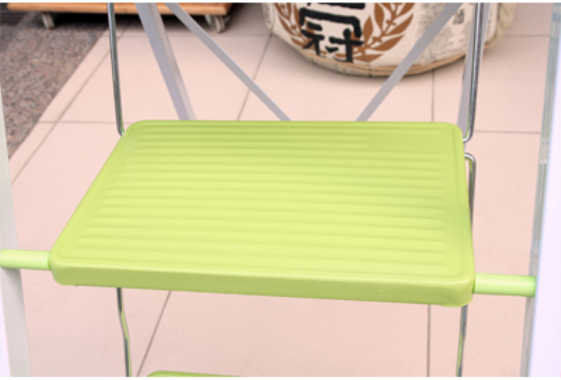
Find the location of `edge of chair foot rest`. edge of chair foot rest is located at coordinates (171, 372).